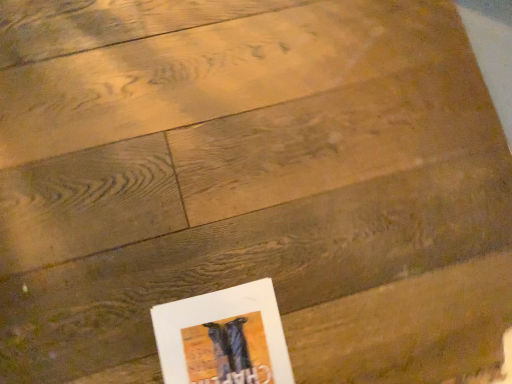
This screenshot has width=512, height=384. Describe the element at coordinates (223, 337) in the screenshot. I see `white paper at lower center` at that location.

Identify the location of white paper at lower center. (223, 337).

The width and height of the screenshot is (512, 384). I want to click on white paper at lower center, so click(x=223, y=337).